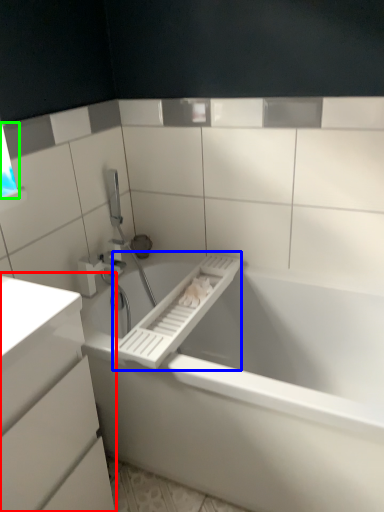
Question: Based on their relative distances, which object is farther from bathroom cabinet (highlighted by a red box)? Choose from towel bar (highlighted by a blue box) and window (highlighted by a green box).

Choices:
 (A) towel bar
 (B) window

Answer: (B)